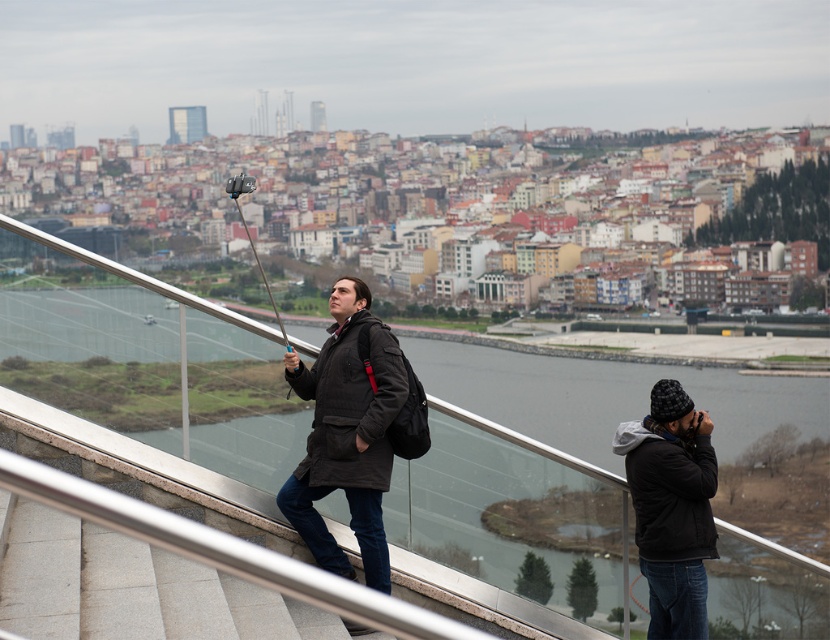
Question: Does dark brown leather jacket at center have a smaller size compared to black quilted jacket at lower right?

Choices:
 (A) yes
 (B) no

Answer: (B)

Question: Which point is closer to the camera taking this photo?

Choices:
 (A) (299, 468)
 (B) (692, 532)
 (C) (388, 362)
 (D) (77, 314)

Answer: (D)

Question: Which object appears closest to the camera in this image?

Choices:
 (A) dark brown leather jacket at center
 (B) transparent glass water at center

Answer: (A)

Question: Where is transparent glass water at center located in relation to dark brown leather jacket at center in the image?

Choices:
 (A) above
 (B) below

Answer: (B)

Question: Can you confirm if dark brown leather jacket at center is positioned below brown matte jacket at center?

Choices:
 (A) yes
 (B) no

Answer: (B)

Question: Which point appears farthest from the camera in this image?

Choices:
 (A) (354, 444)
 (B) (706, 440)

Answer: (B)